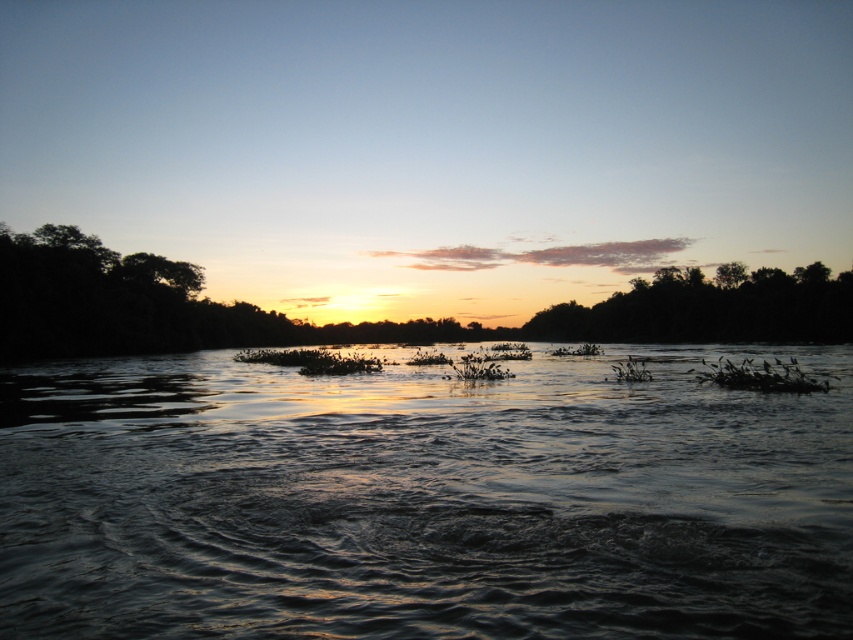
Between dark reflective water at center and silhouette/textured trees at right, which one is positioned lower?

dark reflective water at center is lower down.

Can you confirm if dark reflective water at center is smaller than silhouette/textured trees at right?

Correct, dark reflective water at center occupies less space than silhouette/textured trees at right.

Measure the distance between dark reflective water at center and camera.

A distance of 14.84 feet exists between dark reflective water at center and camera.

This screenshot has height=640, width=853. I want to click on dark reflective water at center, so click(422, 499).